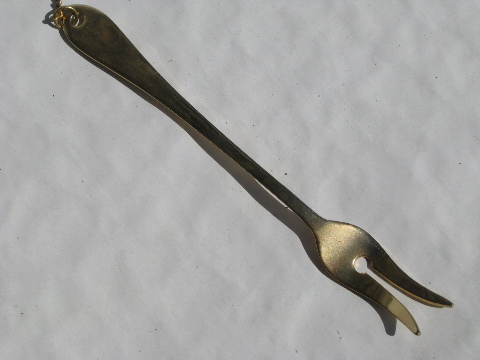
Locate an element on the screen. fork is located at coordinates (129, 65).